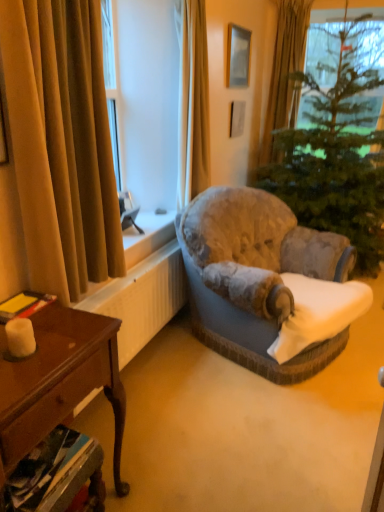
The image size is (384, 512). I want to click on vacant area that lies between velvet grey armchair at center and white textured radiator at lower left, so click(186, 392).